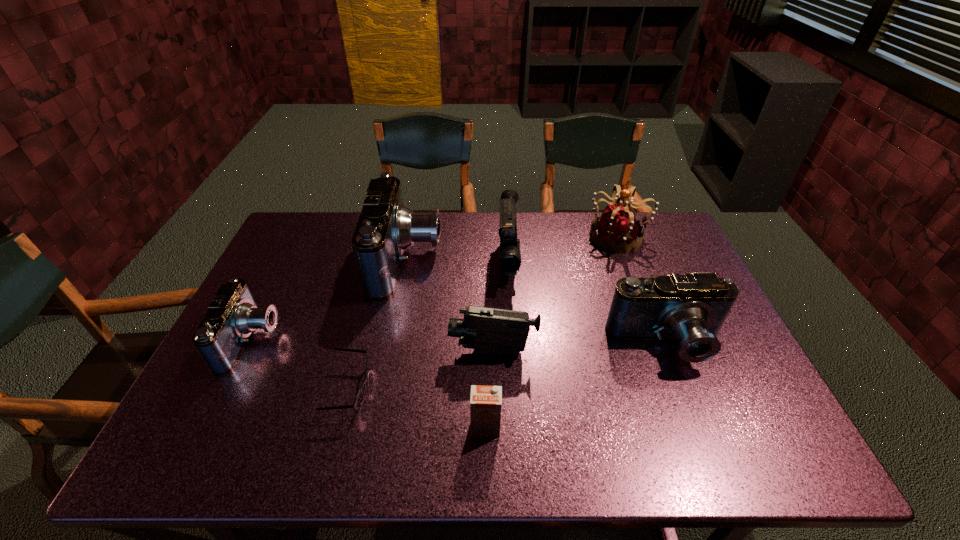
Find the location of a particular element. black spectacles is located at coordinates (359, 398).

Locate an element on the screen. This screenshot has width=960, height=540. spectacles is located at coordinates (359, 398).

Where is `vacant area located 0.160m on the front-facing side of the biggest blue camcorder`? The width and height of the screenshot is (960, 540). vacant area located 0.160m on the front-facing side of the biggest blue camcorder is located at coordinates (492, 260).

The height and width of the screenshot is (540, 960). What are the coordinates of `vacant space located on the front-facing side of the red tiara` in the screenshot? It's located at (549, 237).

Find the location of `vacant area situated 0.390m on the front-facing side of the red tiara`. vacant area situated 0.390m on the front-facing side of the red tiara is located at coordinates (472, 237).

You are a GUI agent. You are given a task and a screenshot of the screen. Output one action in this format:
    pyautogui.click(x=<x>, y=<y>)
    Task: Click on the vacant space located on the front-facing side of the red tiara
    The width and height of the screenshot is (960, 540).
    Given the screenshot: What is the action you would take?
    pyautogui.click(x=502, y=237)

The height and width of the screenshot is (540, 960). I want to click on free space located 0.300m on the front-facing side of the farther black camcorder, so click(516, 382).

Identify the location of vacant space located 0.050m on the front-facing side of the rightmost camcorder. The width and height of the screenshot is (960, 540). (684, 390).

The height and width of the screenshot is (540, 960). What are the coordinates of `free space located 0.080m on the front-facing side of the smaller black camcorder` in the screenshot? It's located at (418, 351).

Locate an element on the screen. The height and width of the screenshot is (540, 960). free spot located 0.080m on the front-facing side of the smaller black camcorder is located at coordinates (418, 351).